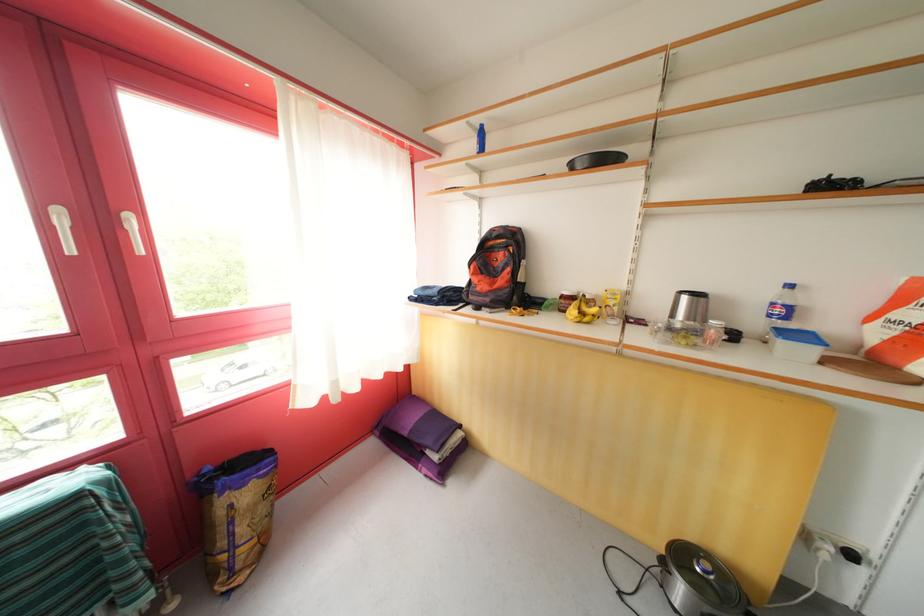
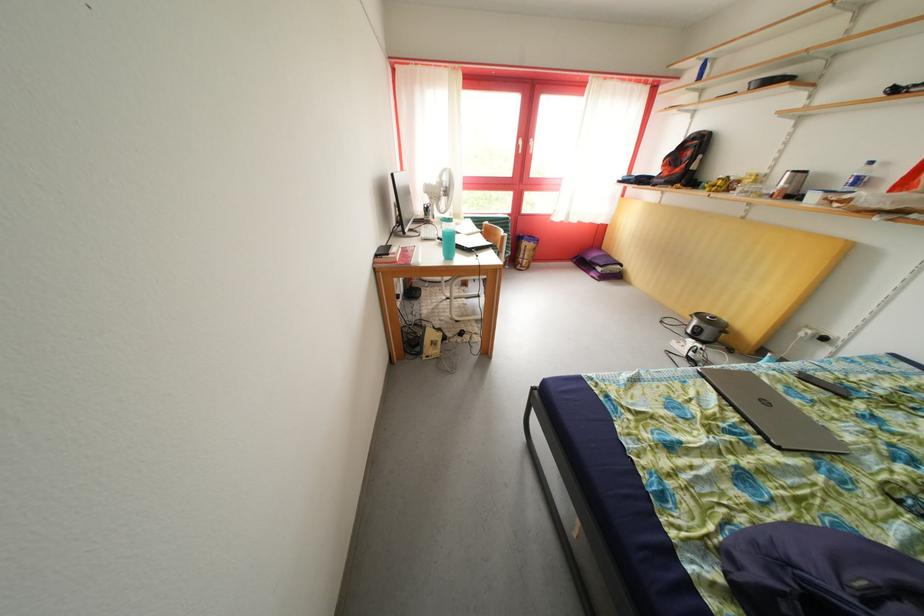
Locate, in the second image, the point that corresponds to (x=67, y=228) in the first image.

(528, 148)